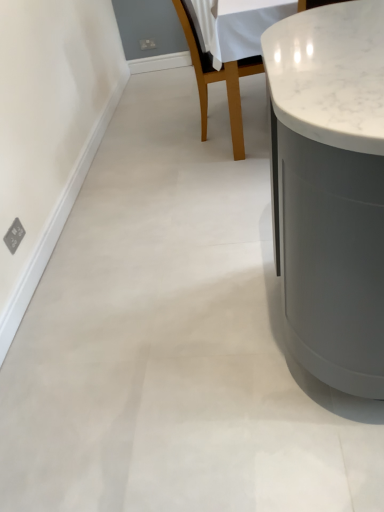
Question: Which is correct: wooden chair at center is inside white marble countertop at upper right, or outside of it?

Choices:
 (A) outside
 (B) inside

Answer: (B)

Question: Considering the relative positions of wooden chair at center and white marble countertop at upper right in the image provided, is wooden chair at center to the left or to the right of white marble countertop at upper right?

Choices:
 (A) left
 (B) right

Answer: (A)

Question: Considering the positions of wooden chair at center and white marble countertop at upper right in the image, is wooden chair at center bigger or smaller than white marble countertop at upper right?

Choices:
 (A) small
 (B) big

Answer: (A)

Question: Is white marble countertop at upper right taller or shorter than wooden chair at center?

Choices:
 (A) tall
 (B) short

Answer: (B)

Question: Considering the positions of point (377, 37) and point (233, 146), is point (377, 37) closer or farther from the camera than point (233, 146)?

Choices:
 (A) closer
 (B) farther

Answer: (A)

Question: Considering the positions of white marble countertop at upper right and wooden chair at center in the image, is white marble countertop at upper right bigger or smaller than wooden chair at center?

Choices:
 (A) small
 (B) big

Answer: (B)

Question: Is white marble countertop at upper right in front of or behind wooden chair at center in the image?

Choices:
 (A) behind
 (B) front

Answer: (B)